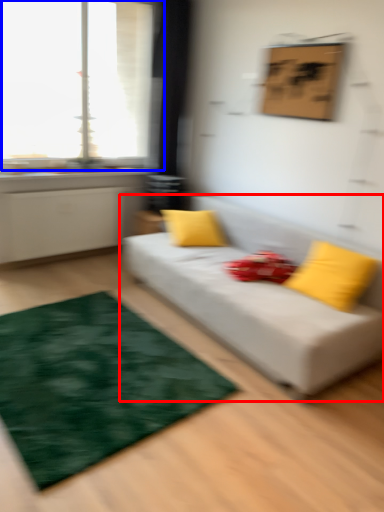
Question: Among these objects, which one is farthest to the camera, studio couch (highlighted by a red box) or window (highlighted by a blue box)?

Choices:
 (A) studio couch
 (B) window

Answer: (B)